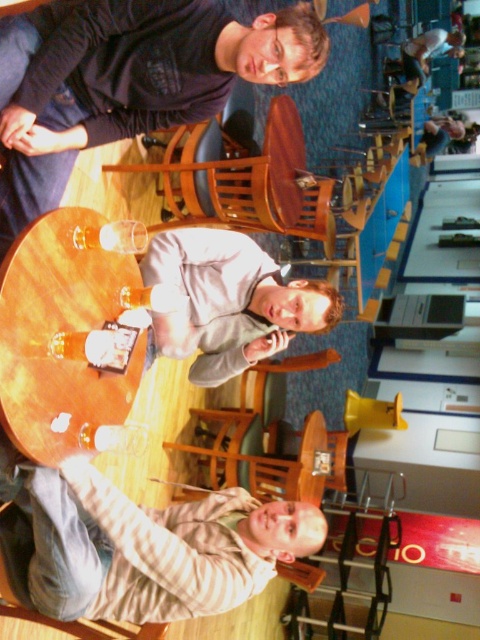
Question: Can you confirm if matte black hoodie at upper center is thinner than wooden table at center?

Choices:
 (A) yes
 (B) no

Answer: (B)

Question: Among these objects, which one is nearest to the camera?

Choices:
 (A) matte black hoodie at upper center
 (B) wooden table at center

Answer: (B)

Question: In this image, where is matte black hoodie at upper center located relative to wooden table at center?

Choices:
 (A) left
 (B) right

Answer: (B)

Question: Where is matte black hoodie at upper center located in relation to wooden table at center in the image?

Choices:
 (A) below
 (B) above

Answer: (B)